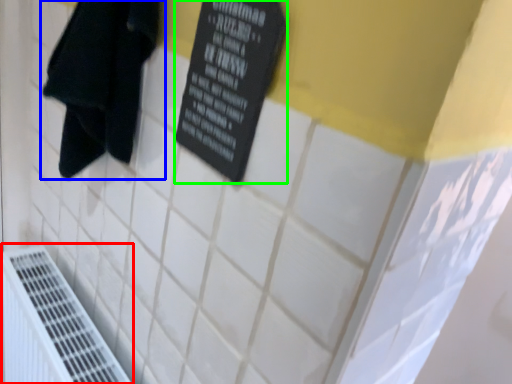
Question: Considering the real-world distances, which object is farthest from air conditioning (highlighted by a red box)? towel (highlighted by a blue box) or bulletin board (highlighted by a green box)?

Choices:
 (A) towel
 (B) bulletin board

Answer: (B)